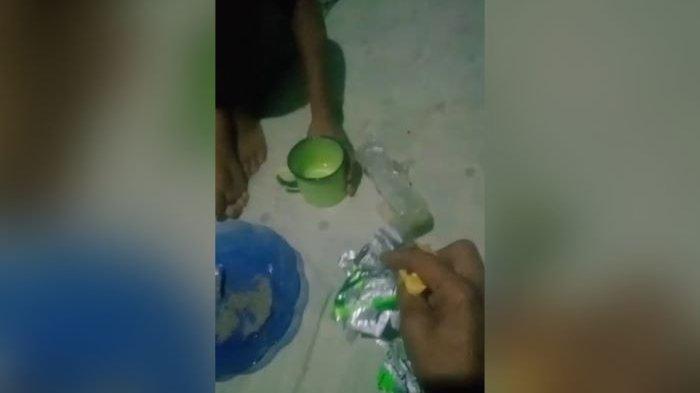
Find the location of a particular element. Image resolution: width=700 pixels, height=393 pixels. picture is located at coordinates (419, 151).